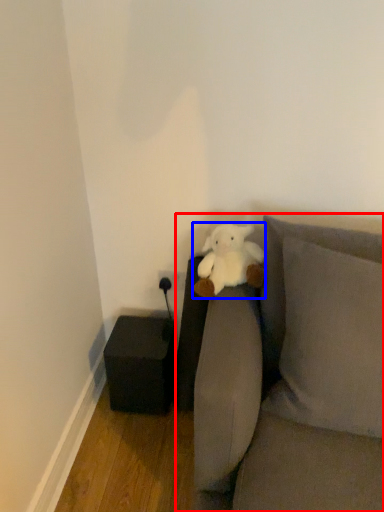
Question: Which object is closer to the camera taking this photo, studio couch (highlighted by a red box) or teddy bear (highlighted by a blue box)?

Choices:
 (A) studio couch
 (B) teddy bear

Answer: (A)